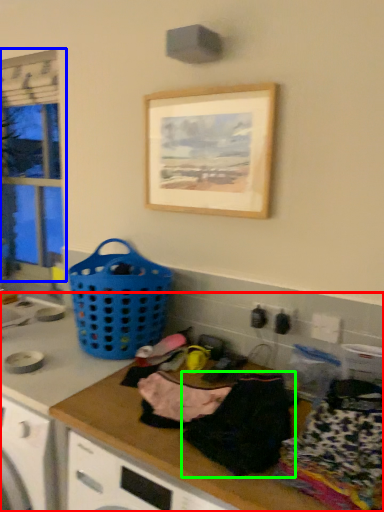
Question: Which is nearer to the counter top (highlighted by a red box)? window (highlighted by a blue box) or clothing (highlighted by a green box).

Choices:
 (A) window
 (B) clothing

Answer: (B)